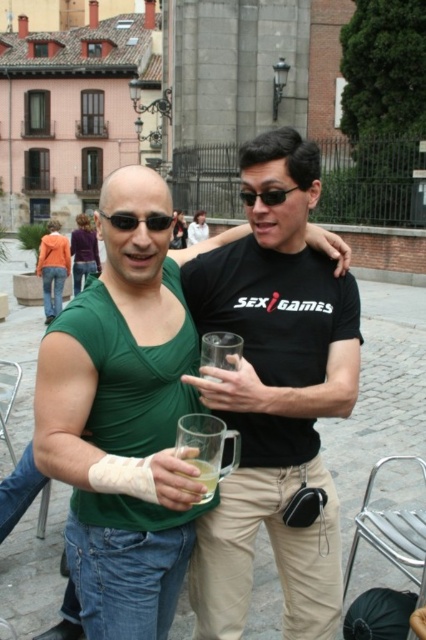
Please describe the location of the orange cotton jacket at upper left in the image using coordinate points.

The orange cotton jacket at upper left is located at coordinate point [52,268].

You are a photographer trying to capture a clear shot of both the black matte sunglasses at center and the white fabric shirt at upper center. Since the camera can only focus on one object at a time, which object should you focus on to ensure the other remains in the background?

You should focus on the black matte sunglasses at center because it is closer to the viewer, making the white fabric shirt at upper center appear in the background.